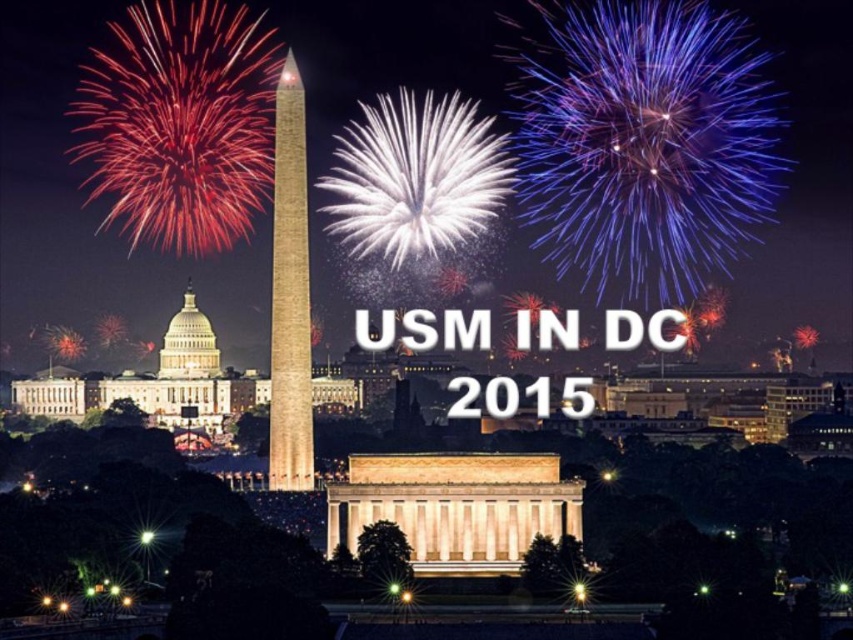
You are an architect reviewing the design of the Washington D.C. night scene. Based on the elevation of the smooth stone monument at center and the white marble dome at center, which one is positioned higher in the image?

The smooth stone monument at center is located above the white marble dome at center, so it is positioned higher in the image.